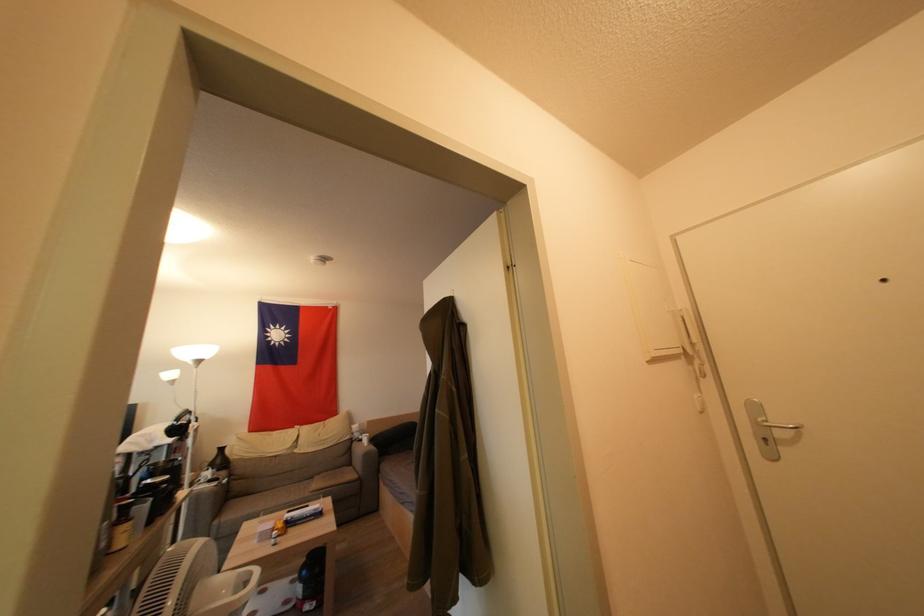
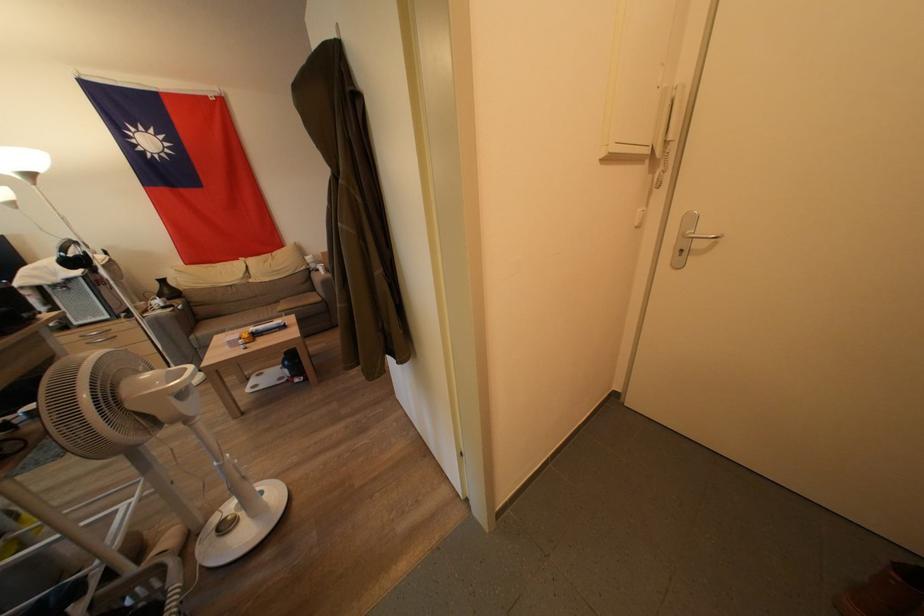
Locate, in the second image, the point that corresponds to [246,482] in the first image.

(207, 309)